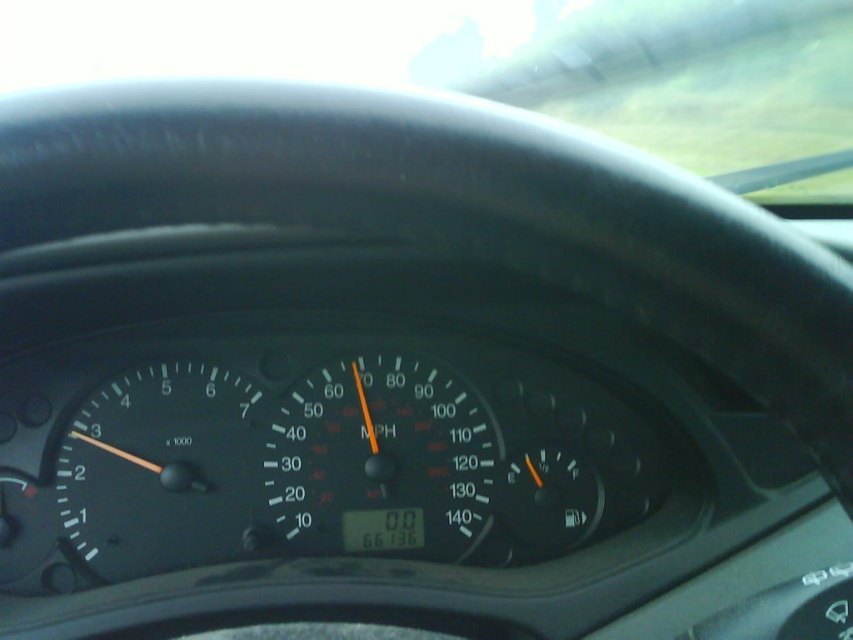
Question: Does transparent glass windshield at upper center have a larger size compared to black plastic speedometer at center?

Choices:
 (A) yes
 (B) no

Answer: (A)

Question: Which point is farther to the camera?

Choices:
 (A) transparent glass windshield at upper center
 (B) black plastic speedometer at center

Answer: (A)

Question: Is transparent glass windshield at upper center positioned in front of black plastic speedometer at center?

Choices:
 (A) no
 (B) yes

Answer: (A)

Question: Is transparent glass windshield at upper center positioned behind black plastic speedometer at center?

Choices:
 (A) no
 (B) yes

Answer: (B)